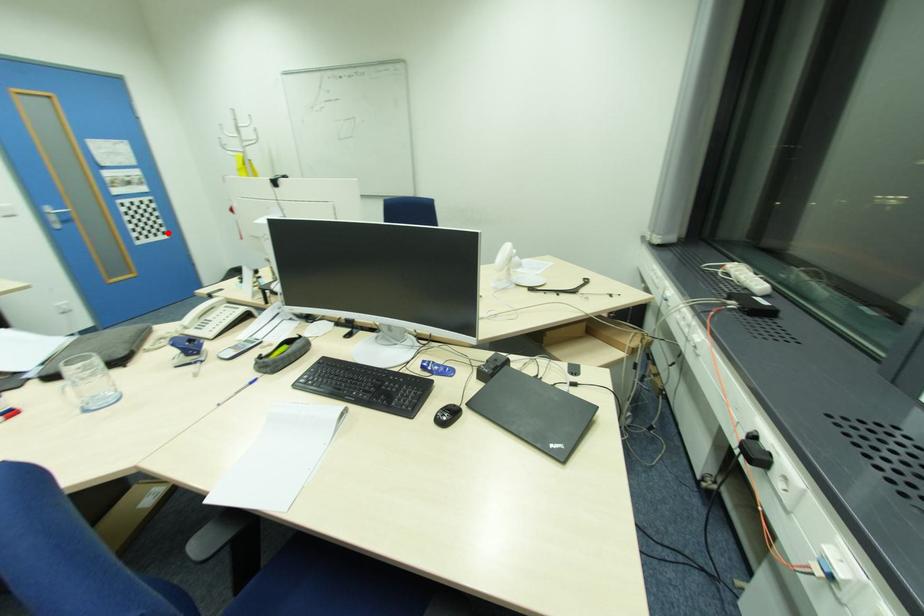
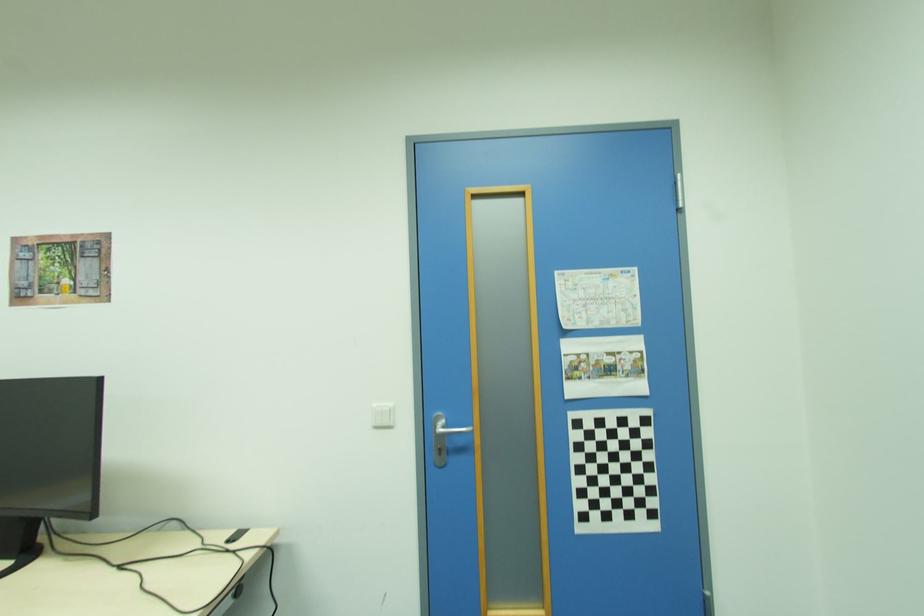
Where in the second image is the point corresponding to the highlighted location from the first image?

(655, 515)